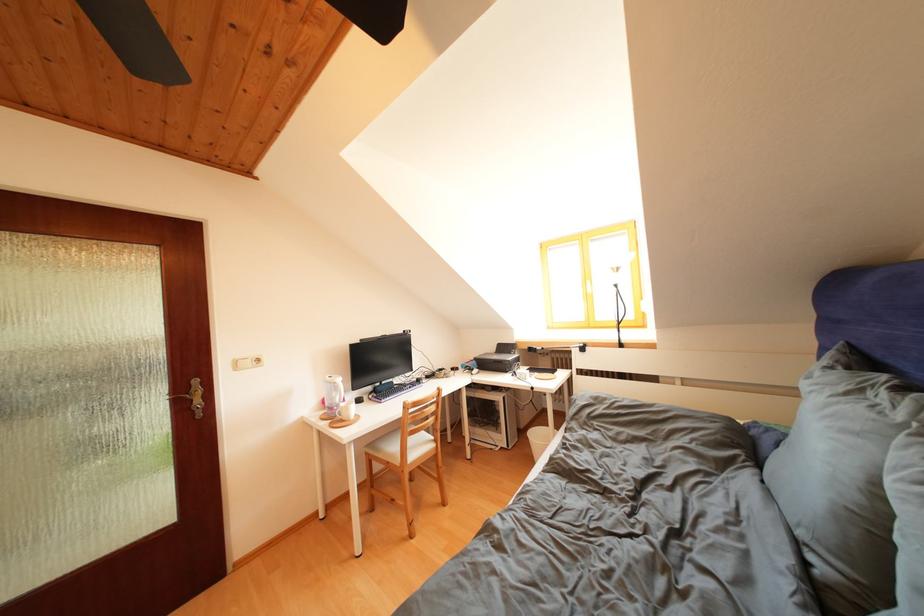
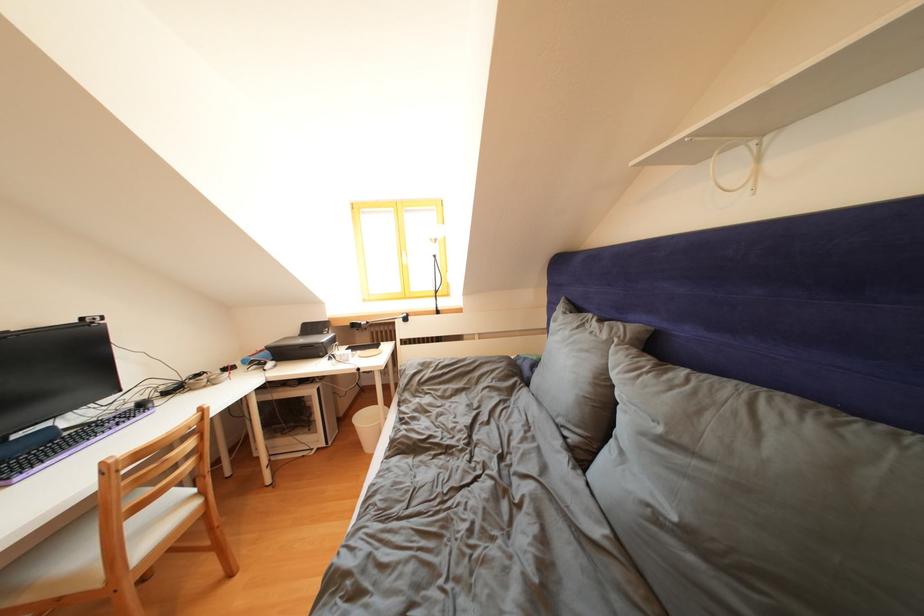
Where in the second image is the point corresponding to [619,342] from the first image?

(438, 310)